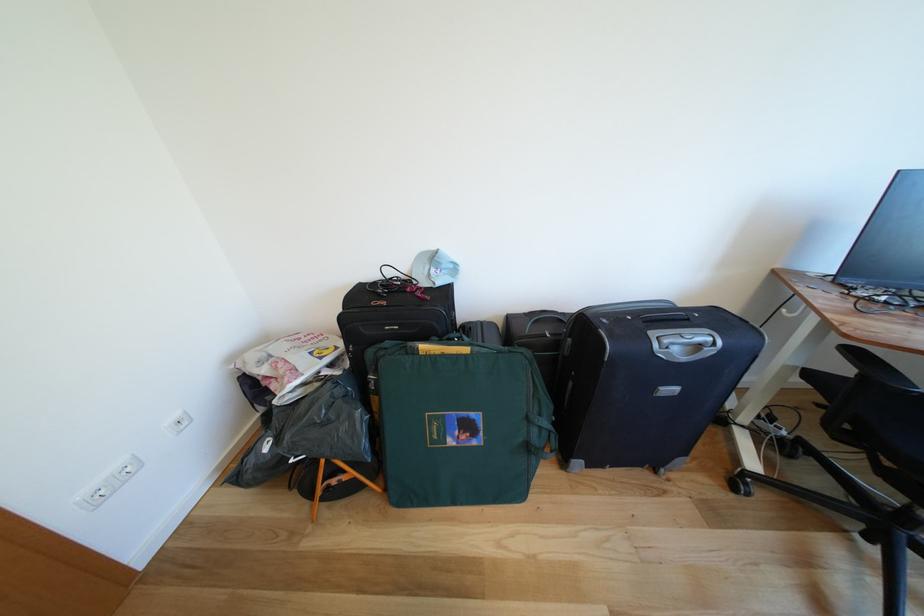
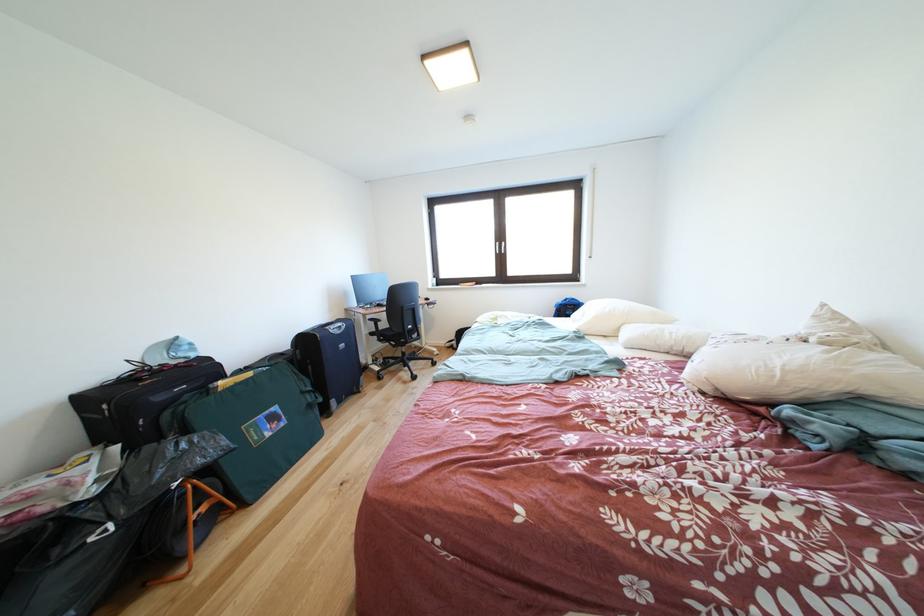
The point at (475, 354) is marked in the first image. Where is the corresponding point in the second image?

(259, 379)